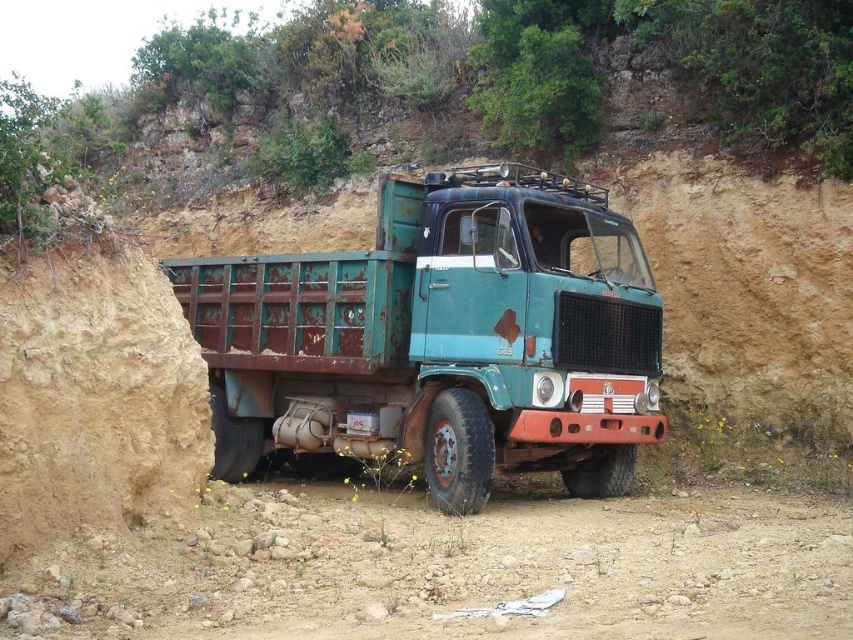
You are standing near the vintage dump truck and want to determine which of the two points, point (460, 262) or point (384, 536), is closer to you. Which one is nearer?

Point (460, 262) is further to the viewer than point (384, 536), so the closer point is point (384, 536).

You are a surveyor using a coordinate system where the bottom left corner of the image is the origin point. You need to locate the rusty metal trailer truck at center. What are its coordinates?

The coordinates of the rusty metal trailer truck at center are at point [440,339].